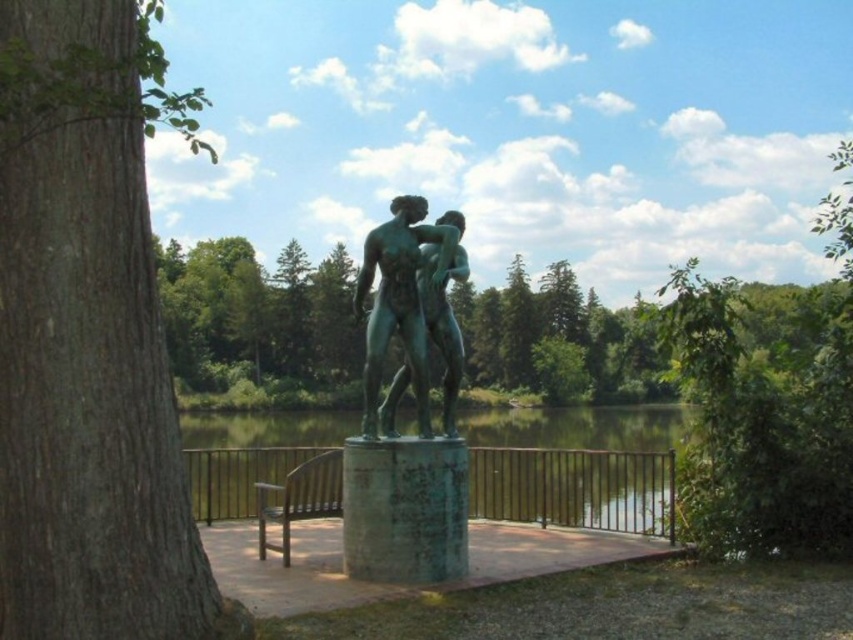
Is greenish reflective water at center further to the viewer compared to green patina statue at center?

That is True.

Who is more forward, (212, 483) or (432, 291)?

Positioned in front is point (432, 291).

The image size is (853, 640). What are the coordinates of `greenish reflective water at center` in the screenshot? It's located at (575, 465).

Which is more to the right, green rough bark tree at left or green patina statue at center?

green patina statue at center

Is green rough bark tree at left positioned in front of green patina statue at center?

Yes, green rough bark tree at left is in front of green patina statue at center.

Measure the distance between point (143, 584) and camera.

Point (143, 584) and camera are 5.21 meters apart.

The width and height of the screenshot is (853, 640). I want to click on green rough bark tree at left, so click(x=90, y=339).

What are the coordinates of `green rough bark tree at left` in the screenshot? It's located at (90, 339).

Is green rough bark tree at left wider than wooden park bench at lower center?

Indeed, green rough bark tree at left has a greater width compared to wooden park bench at lower center.

Is point (61, 436) positioned after point (315, 484)?

That is False.

Locate an element on the screen. green rough bark tree at left is located at coordinates (90, 339).